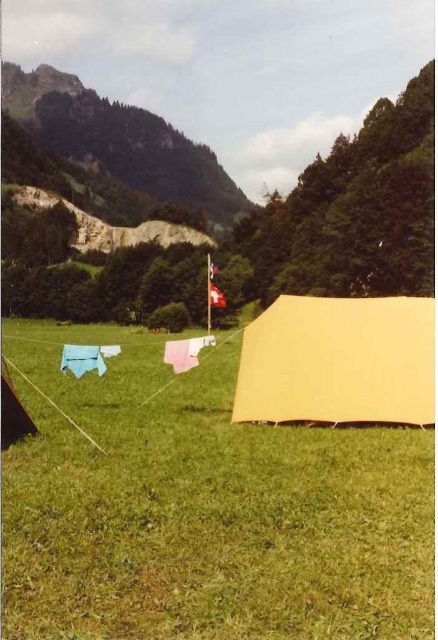
Question: Is yellow fabric tent at right in front of blue fabric at lower left?

Choices:
 (A) yes
 (B) no

Answer: (A)

Question: Which point is farther to the camera?

Choices:
 (A) beige fabric tent at center
 (B) pink fabric at center
 (C) red fabric flag at center
 (D) yellow fabric tent at right

Answer: (C)

Question: Is yellow fabric tent at right smaller than blue fabric at lower left?

Choices:
 (A) yes
 (B) no

Answer: (B)

Question: Which point is closer to the camera?

Choices:
 (A) (208, 305)
 (B) (168, 433)

Answer: (B)

Question: Is pink fabric at center positioned behind red fabric flag at center?

Choices:
 (A) no
 (B) yes

Answer: (A)

Question: Among these points, which one is nearest to the camera?

Choices:
 (A) (200, 349)
 (B) (66, 352)
 (C) (216, 300)

Answer: (A)